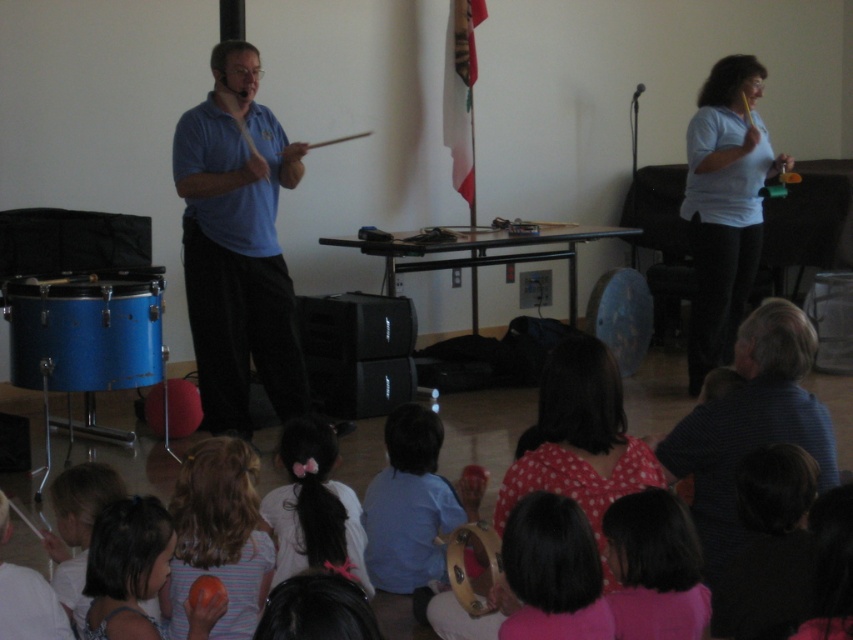
Does matte blue shirt at center lie in front of blonde hair at lower left?

No, it is not.

Can you confirm if matte blue shirt at center is bigger than blonde hair at lower left?

Correct, matte blue shirt at center is larger in size than blonde hair at lower left.

Locate an element on the screen. The height and width of the screenshot is (640, 853). matte blue shirt at center is located at coordinates [x=236, y=244].

Image resolution: width=853 pixels, height=640 pixels. Find the location of `matte blue shirt at center`. matte blue shirt at center is located at coordinates (236, 244).

Is matte blue shirt at center wider than dark blue striped shirt at lower right?

Indeed, matte blue shirt at center has a greater width compared to dark blue striped shirt at lower right.

Who is taller, matte blue shirt at center or dark blue striped shirt at lower right?

Standing taller between the two is matte blue shirt at center.

Between point (281, 186) and point (683, 426), which one is positioned behind?

The point (281, 186) is more distant.

Find the location of `matte blue shirt at center`. matte blue shirt at center is located at coordinates (236, 244).

Does striped fabric dress at lower left have a greater width compared to matte orange ball at lower left?

In fact, striped fabric dress at lower left might be narrower than matte orange ball at lower left.

Does striped fabric dress at lower left appear on the right side of matte orange ball at lower left?

Yes, striped fabric dress at lower left is to the right of matte orange ball at lower left.

Image resolution: width=853 pixels, height=640 pixels. Identify the location of striped fabric dress at lower left. (218, 536).